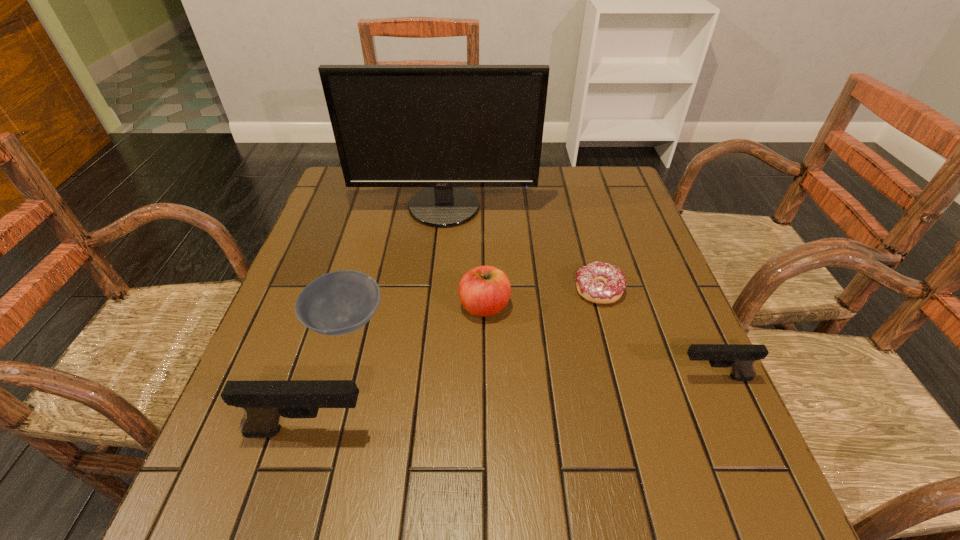
In order to click on free space for an extra pistol to achieve even spacing in this screenshot , I will do `click(520, 403)`.